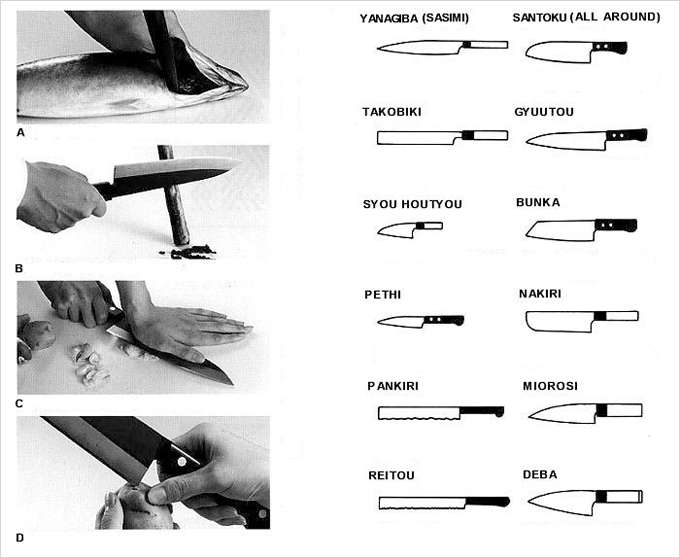
You are a GUI agent. You are given a task and a screenshot of the screen. Output one action in this format:
    pyautogui.click(x=<x>, y=<y>)
    Task: Click on the table
    This screenshot has height=558, width=680.
    Given the screenshot: What is the action you would take?
    pyautogui.click(x=253, y=367), pyautogui.click(x=243, y=223), pyautogui.click(x=250, y=108)